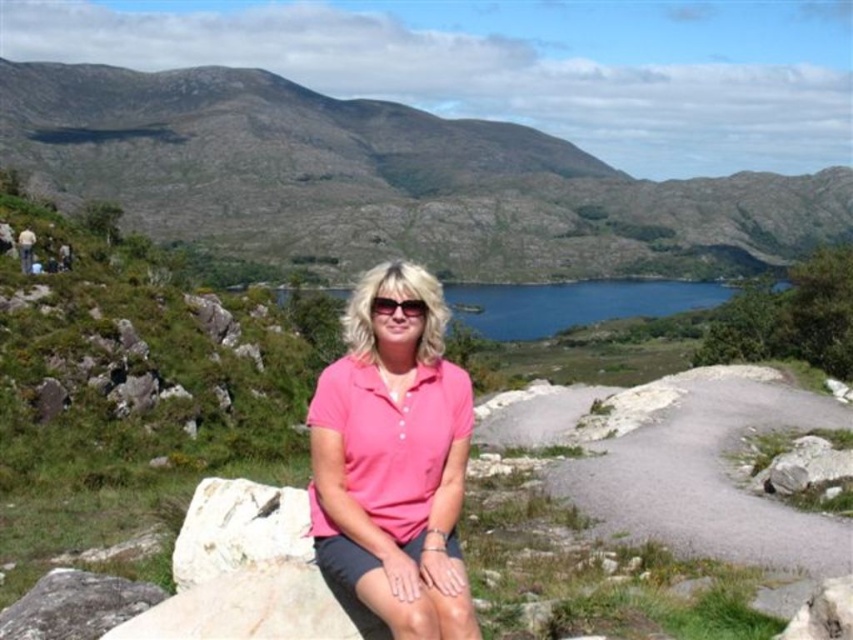
Question: Does green grassy hillside at upper center lie behind pink cotton polo shirt at center?

Choices:
 (A) no
 (B) yes

Answer: (B)

Question: Which object is farther from the camera taking this photo?

Choices:
 (A) green grassy hillside at upper center
 (B) blue glassy water at center
 (C) pink cotton polo shirt at center
 (D) white rough rock at lower left

Answer: (A)

Question: Is green grassy hillside at upper center thinner than pink cotton shirt at center?

Choices:
 (A) yes
 (B) no

Answer: (B)

Question: Is blue glassy water at center above gray rough rock at lower left?

Choices:
 (A) yes
 (B) no

Answer: (A)

Question: Which object appears closest to the camera in this image?

Choices:
 (A) gray rough rock at lower left
 (B) green grassy hillside at upper center
 (C) pink cotton polo shirt at center
 (D) blue glassy water at center

Answer: (C)

Question: Which of the following is the farthest from the observer?

Choices:
 (A) (305, 108)
 (B) (384, 310)

Answer: (A)